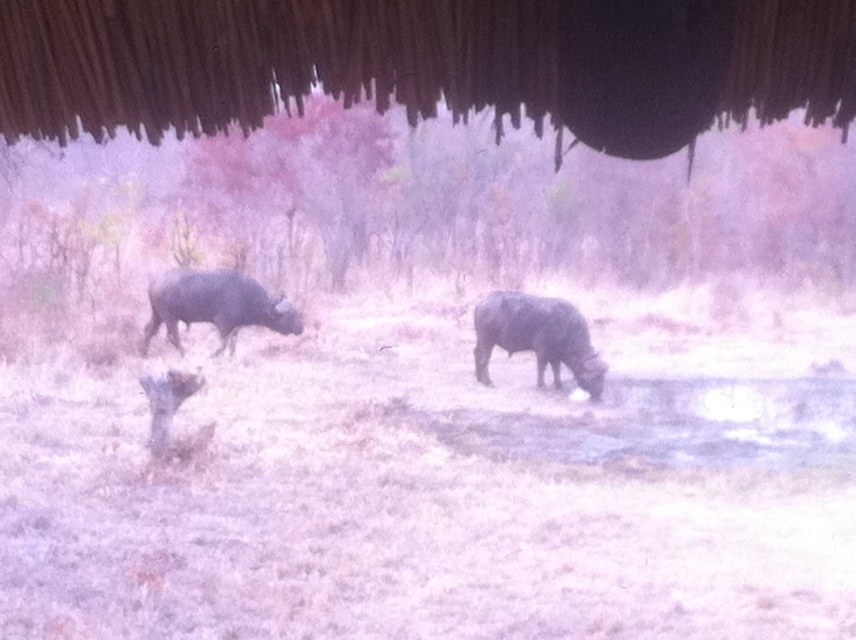
Question: Which point is closer to the camera?

Choices:
 (A) (236, 300)
 (B) (557, 326)

Answer: (B)

Question: Can you confirm if dark gray matte yak at center is positioned to the right of dark gray matte yak at left?

Choices:
 (A) yes
 (B) no

Answer: (A)

Question: Can you confirm if dark gray matte yak at center is positioned to the right of dark gray matte yak at left?

Choices:
 (A) yes
 (B) no

Answer: (A)

Question: Is dark gray matte yak at center closer to camera compared to dark gray matte yak at left?

Choices:
 (A) yes
 (B) no

Answer: (A)